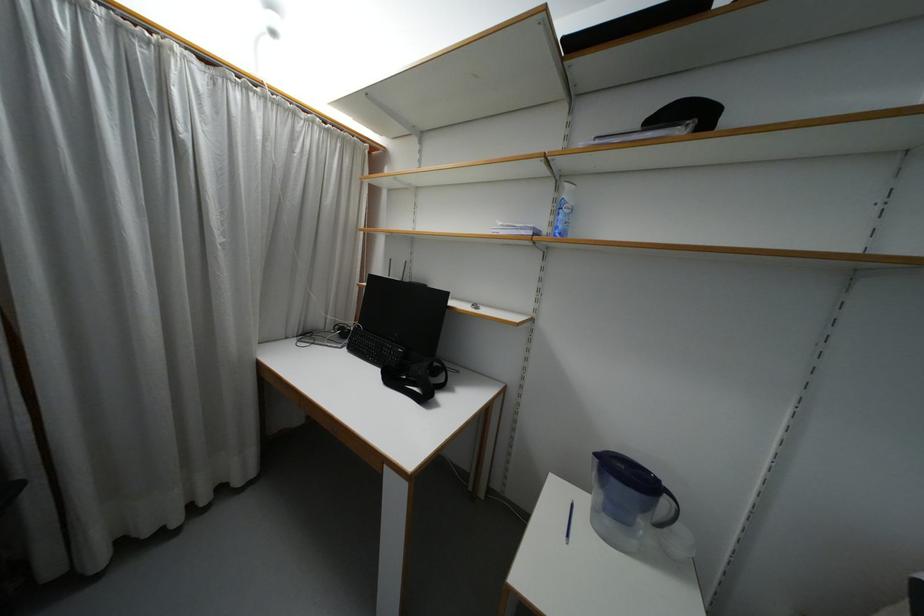
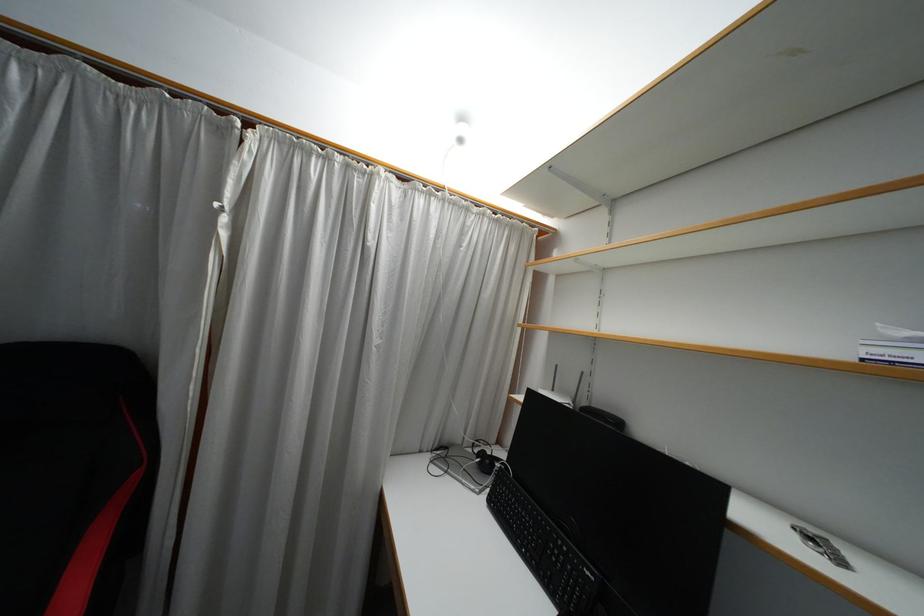
Where in the second image is the point corresponding to [273,33] from the first image?

(459, 140)